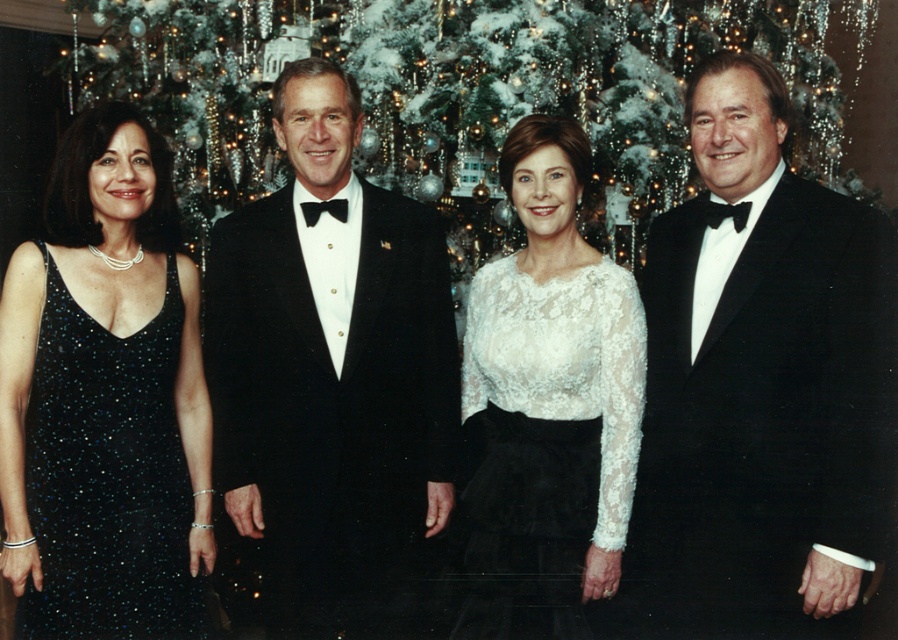
You are a photographer adjusting the camera settings for the group portrait. You notice two tuxedos in the scene. Which tuxedo, the black satin tuxedo at right or the black velvet tuxedo at center, is shorter in height?

The black satin tuxedo at right has a lesser height compared to the black velvet tuxedo at center, so the black satin tuxedo at right is shorter.

You are standing at the camera position and want to place a small decoration exactly 8 feet away from you. Is the point at coordinate point (x=782, y=566) within the required distance?

The distance of point (x=782, y=566) from camera is 7.53 feet, which is less than 8 feet. Therefore, the point is within the required distance.